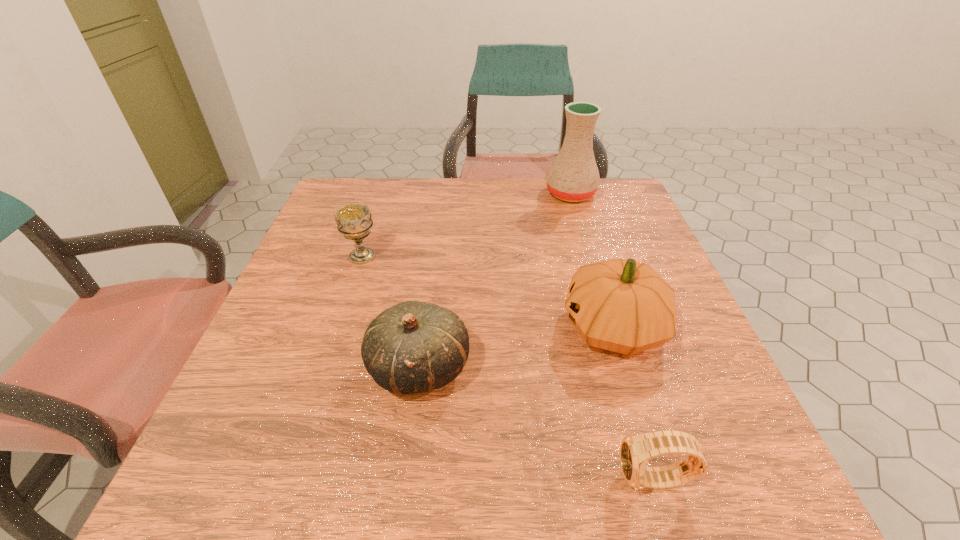
Find the location of a particular element. the tallest object is located at coordinates (x=573, y=176).

This screenshot has width=960, height=540. In order to click on the farthest object in this screenshot , I will do `click(573, 176)`.

Find the location of a particular element. The image size is (960, 540). the fourth shortest object is located at coordinates (624, 306).

The height and width of the screenshot is (540, 960). I want to click on the taller gourd, so click(624, 306).

Image resolution: width=960 pixels, height=540 pixels. Find the location of `the second object from left to right`. the second object from left to right is located at coordinates (412, 347).

This screenshot has width=960, height=540. What are the coordinates of `the left gourd` in the screenshot? It's located at (412, 347).

Locate an element on the screen. The image size is (960, 540). the leftmost object is located at coordinates (354, 221).

Where is `chalice`? chalice is located at coordinates (354, 221).

Find the location of `watch`. watch is located at coordinates click(636, 450).

Identify the location of the nearest object. point(636,450).